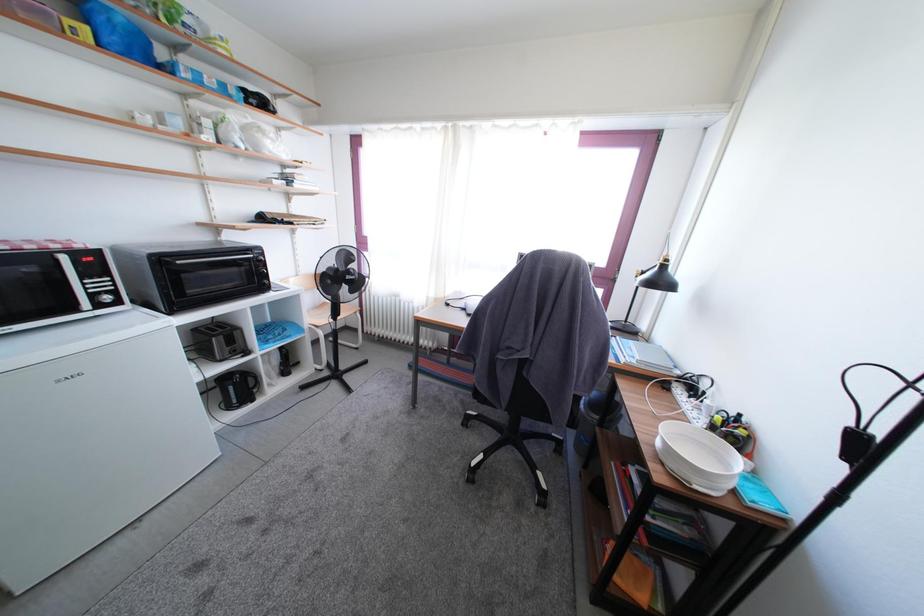
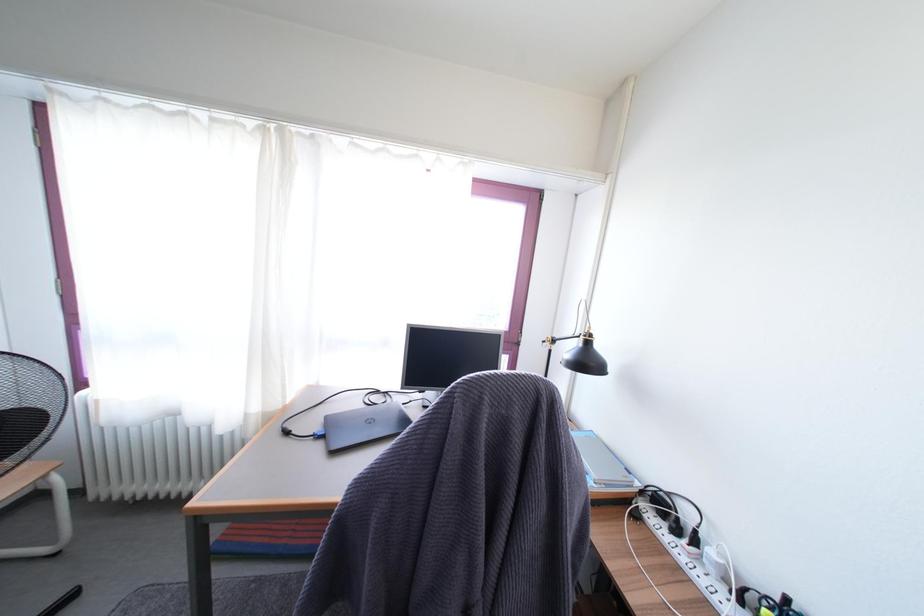
Question: What movement of the cameraman would produce the second image?

Choices:
 (A) Left
 (B) Right
 (C) Forward
 (D) Backward

Answer: (C)